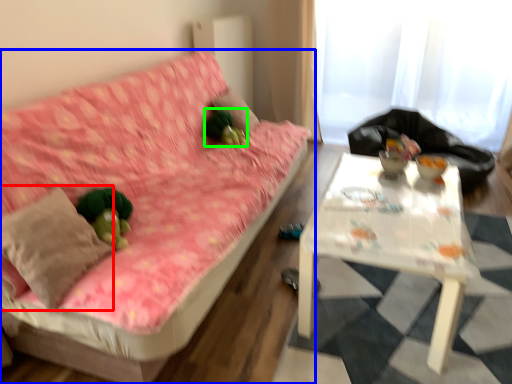
Question: Which is farther away from throw pillow (highlighted by a red box)? studio couch (highlighted by a blue box) or toy (highlighted by a green box)?

Choices:
 (A) studio couch
 (B) toy

Answer: (B)